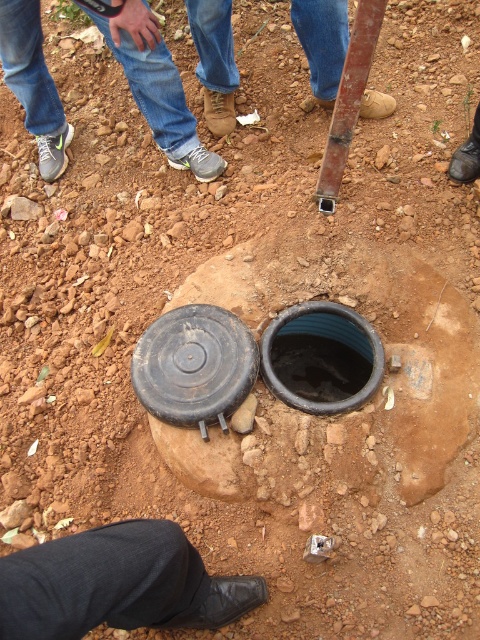
Question: In this image, where is black rubber manhole at center located relative to brown leather boots at center?

Choices:
 (A) above
 (B) below

Answer: (B)

Question: Which of these objects is positioned closest to the brown leather boots at center?

Choices:
 (A) gray fabric shoe at lower left
 (B) black rubber manhole at center

Answer: (A)

Question: Is black leather shoe at lower center positioned in front of black rubber manhole at center?

Choices:
 (A) yes
 (B) no

Answer: (A)

Question: Which is farther from the black rubber manhole at center?

Choices:
 (A) brown leather boots at center
 (B) black leather shoe at lower center

Answer: (A)

Question: Which object appears closest to the camera in this image?

Choices:
 (A) black leather shoe at lower center
 (B) brown leather boots at center
 (C) black rubber manhole at center

Answer: (A)

Question: Is gray fabric shoe at lower left below black rubber manhole at center?

Choices:
 (A) yes
 (B) no

Answer: (B)